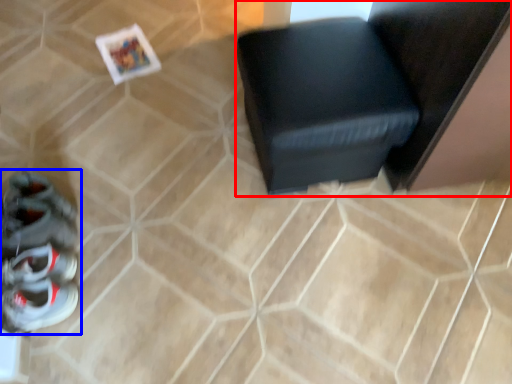
Question: Which object appears closest to the camera in this image, furniture (highlighted by a red box) or footwear (highlighted by a blue box)?

Choices:
 (A) furniture
 (B) footwear

Answer: (B)